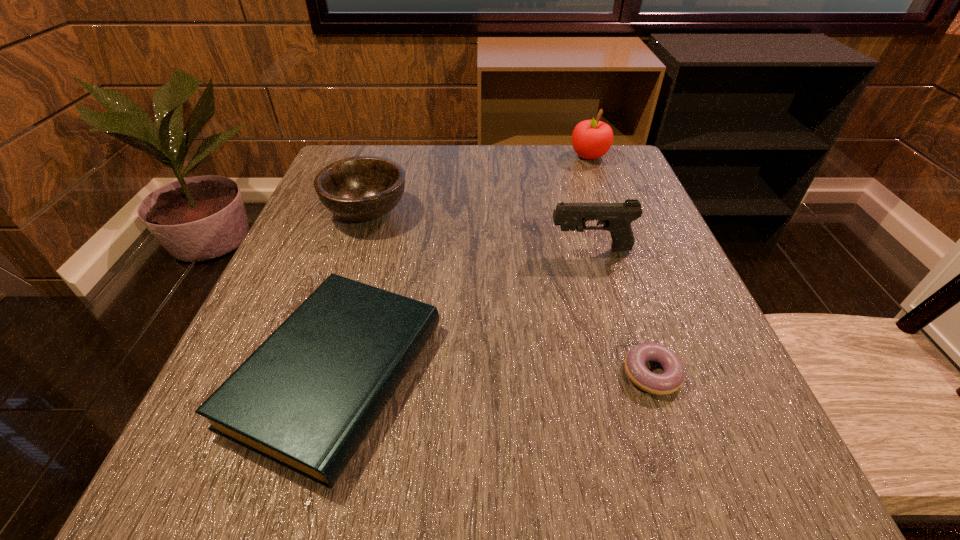
Find the location of a particular element. This screenshot has width=960, height=540. the farthest object is located at coordinates (591, 139).

Image resolution: width=960 pixels, height=540 pixels. Identify the location of pistol. (616, 218).

You are a GUI agent. You are given a task and a screenshot of the screen. Output one action in this format:
    pyautogui.click(x=<x>, y=<y>)
    Task: Click on the second farthest object
    Image resolution: width=960 pixels, height=540 pixels.
    Given the screenshot: What is the action you would take?
    pyautogui.click(x=361, y=188)

Identify the location of bowl. (361, 188).

Locate an element on the screen. The width and height of the screenshot is (960, 540). book is located at coordinates (306, 398).

This screenshot has height=540, width=960. Identify the location of doughnut. (671, 380).

The height and width of the screenshot is (540, 960). I want to click on free space located 0.140m on the left of the apple, so click(x=514, y=156).

Find the location of a particular element. vacant space located at the barrel of the third farthest object is located at coordinates [396, 249].

Locate an element on the screen. free space located 0.340m at the barrel of the third farthest object is located at coordinates (371, 249).

The image size is (960, 540). Find the location of `vacant space located at the barrel of the third farthest object`. vacant space located at the barrel of the third farthest object is located at coordinates (523, 249).